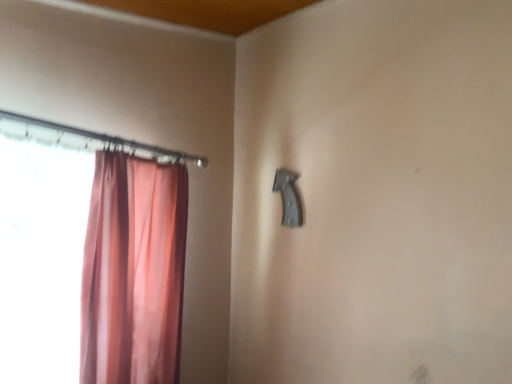
Question: Which is correct: pink sheer curtain at left is inside matte black door handle at upper center, or outside of it?

Choices:
 (A) outside
 (B) inside

Answer: (A)

Question: Is pink sheer curtain at left to the left or to the right of matte black door handle at upper center in the image?

Choices:
 (A) left
 (B) right

Answer: (A)

Question: From a real-world perspective, is pink sheer curtain at left physically located above or below matte black door handle at upper center?

Choices:
 (A) below
 (B) above

Answer: (A)

Question: Would you say matte black door handle at upper center is inside or outside pink sheer curtain at left?

Choices:
 (A) outside
 (B) inside

Answer: (A)

Question: In the image, is matte black door handle at upper center positioned in front of or behind pink sheer curtain at left?

Choices:
 (A) front
 (B) behind

Answer: (B)

Question: Considering the positions of matte black door handle at upper center and pink sheer curtain at left in the image, is matte black door handle at upper center wider or thinner than pink sheer curtain at left?

Choices:
 (A) thin
 (B) wide

Answer: (A)

Question: Is point (278, 172) closer or farther from the camera than point (170, 223)?

Choices:
 (A) farther
 (B) closer

Answer: (A)